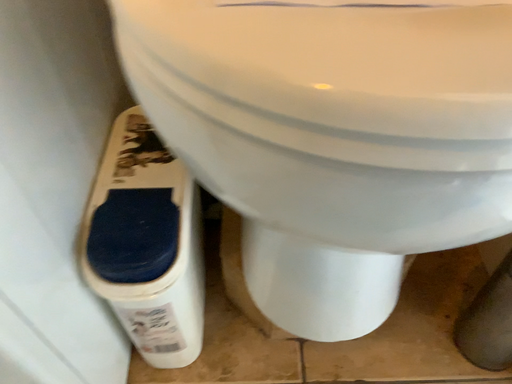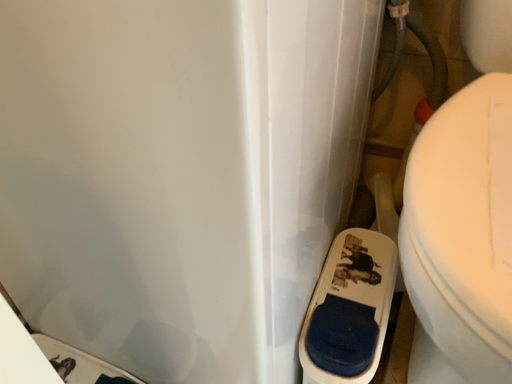
Question: How did the camera likely rotate when shooting the video?

Choices:
 (A) rotated downward
 (B) rotated upward

Answer: (B)